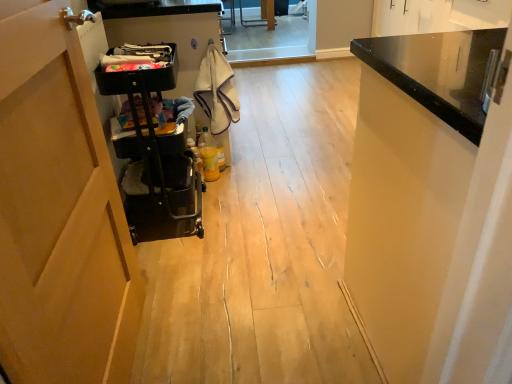
Question: Should I look upward or downward to see black fabric laundry at upper center, which is the 1th laundry in front-to-back order?

Choices:
 (A) down
 (B) up

Answer: (B)

Question: Is white cotton towel at center, which appears as the second laundry when viewed from the left, turned away from black fabric laundry at upper center, the second laundry viewed from the right?

Choices:
 (A) no
 (B) yes

Answer: (A)

Question: Does white cotton towel at center, the 1th laundry positioned from the back, have a smaller size compared to black fabric laundry at upper center, the second laundry viewed from the right?

Choices:
 (A) yes
 (B) no

Answer: (B)

Question: From a real-world perspective, is white cotton towel at center, which appears as the second laundry when viewed from the left, located beneath black fabric laundry at upper center, the second laundry viewed from the back?

Choices:
 (A) no
 (B) yes

Answer: (B)

Question: Could black fabric laundry at upper center, the second laundry viewed from the back, be considered to be inside white cotton towel at center, marked as the second laundry in a front-to-back arrangement?

Choices:
 (A) yes
 (B) no

Answer: (B)

Question: Does white cotton towel at center, which is counted as the 1th laundry, starting from the right, have a greater width compared to black fabric laundry at upper center, which is the 1th laundry in front-to-back order?

Choices:
 (A) no
 (B) yes

Answer: (A)

Question: Is white cotton towel at center, the 1th laundry positioned from the back, with black fabric laundry at upper center, which is the first laundry from left to right?

Choices:
 (A) no
 (B) yes

Answer: (A)

Question: From a real-world perspective, is black plastic trolley at left physically below white cotton towel at center, marked as the second laundry in a front-to-back arrangement?

Choices:
 (A) yes
 (B) no

Answer: (A)

Question: Is black plastic trolley at left located outside white cotton towel at center, which appears as the second laundry when viewed from the left?

Choices:
 (A) yes
 (B) no

Answer: (A)

Question: Considering the relative sizes of black plastic trolley at left and white cotton towel at center, which appears as the second laundry when viewed from the left, in the image provided, is black plastic trolley at left shorter than white cotton towel at center, which appears as the second laundry when viewed from the left,?

Choices:
 (A) yes
 (B) no

Answer: (B)

Question: From a real-world perspective, is black plastic trolley at left on white cotton towel at center, the 1th laundry positioned from the back?

Choices:
 (A) yes
 (B) no

Answer: (B)

Question: Does black plastic trolley at left have a larger size compared to white cotton towel at center, which is counted as the 1th laundry, starting from the right?

Choices:
 (A) no
 (B) yes

Answer: (B)

Question: Does black plastic trolley at left appear on the left side of white cotton towel at center, marked as the second laundry in a front-to-back arrangement?

Choices:
 (A) yes
 (B) no

Answer: (A)

Question: Is black plastic trolley at left closer to the viewer compared to black fabric laundry at upper center, the second laundry viewed from the right?

Choices:
 (A) no
 (B) yes

Answer: (B)